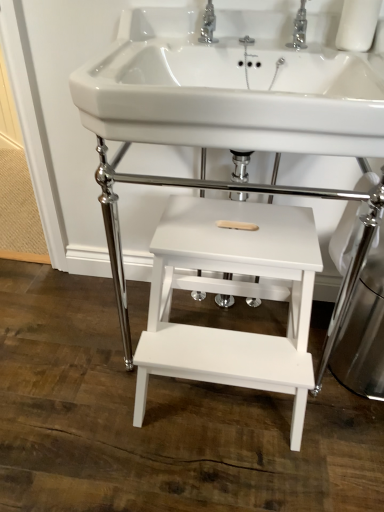
Locate an element on the screen. vacant space in front of white matte wood step stool at center, which is the second table in bottom-to-top order is located at coordinates (213, 467).